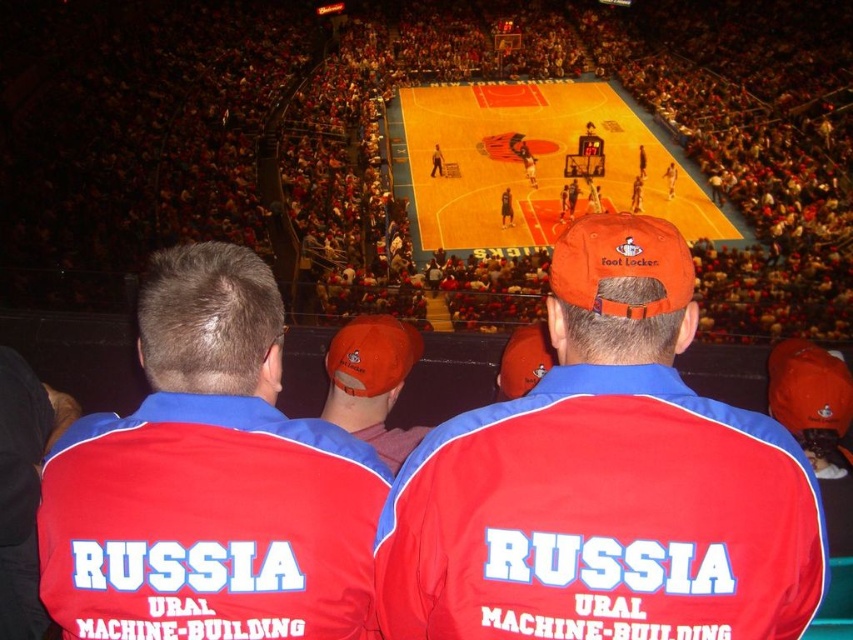
Between matte red cap at center and orange fabric cap at center, which one has less height?

With less height is orange fabric cap at center.

Which is more to the left, matte red cap at center or orange fabric cap at center?

orange fabric cap at center is more to the left.

Where is `matte red cap at center`? matte red cap at center is located at coordinates (605, 481).

Locate an element on the screen. This screenshot has width=853, height=640. matte red cap at center is located at coordinates (605, 481).

In the scene shown: Does matte red cap at center have a smaller size compared to orange polished wood basketball court at center?

Yes.

Between matte red cap at center and orange polished wood basketball court at center, which one appears on the right side from the viewer's perspective?

From the viewer's perspective, orange polished wood basketball court at center appears more on the right side.

Is point (759, 445) more distant than point (676, 195)?

That is False.

Identify the location of matte red cap at center. The width and height of the screenshot is (853, 640). (605, 481).

Which is below, red fabric jacket at center or orange polished wood basketball court at center?

red fabric jacket at center is below.

Can you confirm if red fabric jacket at center is positioned below orange polished wood basketball court at center?

Correct, red fabric jacket at center is located below orange polished wood basketball court at center.

Between point (310, 488) and point (555, 120), which one is positioned behind?

Point (555, 120)

You are a GUI agent. You are given a task and a screenshot of the screen. Output one action in this format:
    pyautogui.click(x=<x>, y=<y>)
    Task: Click on the red fabric jacket at center
    This screenshot has width=853, height=640.
    Given the screenshot: What is the action you would take?
    click(207, 481)